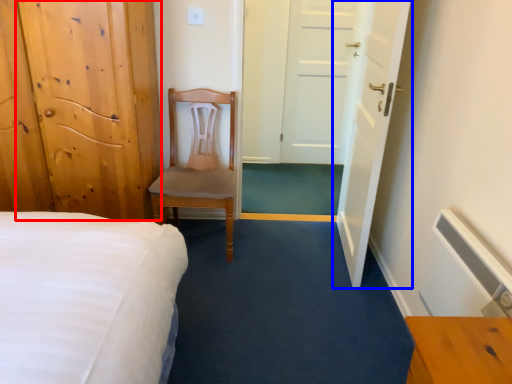
Question: Which object is further to the camera taking this photo, door (highlighted by a red box) or door (highlighted by a blue box)?

Choices:
 (A) door
 (B) door

Answer: (B)